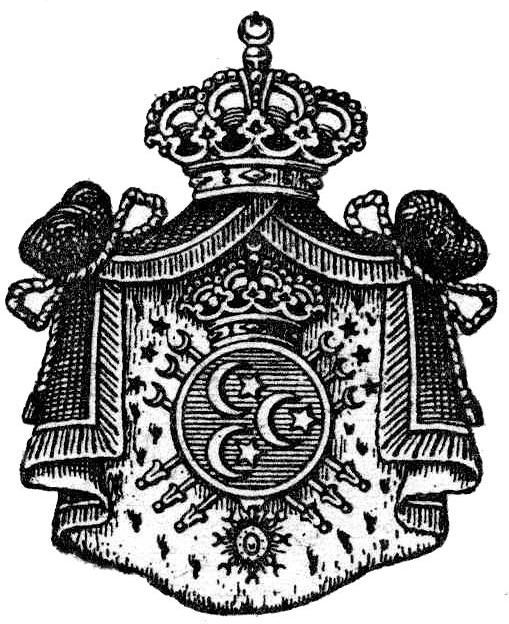
Where is `tassels`? tassels is located at coordinates tap(129, 197), tap(378, 218).